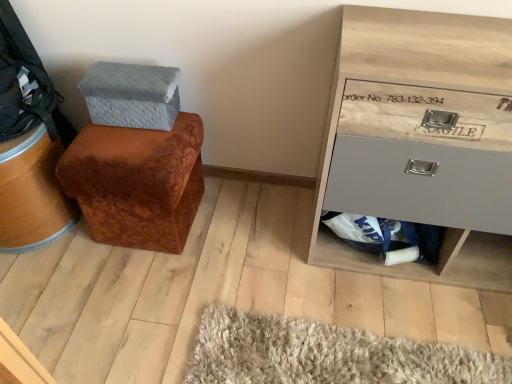
Where is `vacant region in front of wooden drawer at right`? vacant region in front of wooden drawer at right is located at coordinates (416, 324).